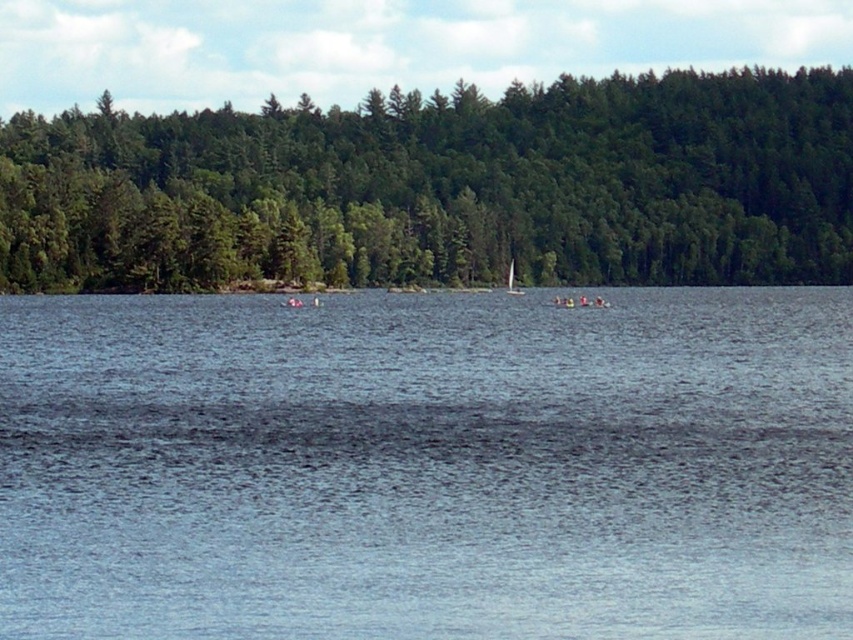
You are standing on the lakeside and want to compare the height of the green matte forest at center and the white glossy sailboat at center. Which one is taller?

The green matte forest at center has a greater height compared to the white glossy sailboat at center, so the green matte forest at center is taller.

Looking at this image, you are standing on the lakeside and want to determine which object is closer to the water surface between the blue water at center and the white glossy sailboat at center. Based on their heights, which one is closer?

The blue water at center has a lesser height compared to the white glossy sailboat at center, so the blue water at center is closer to the water surface.

You are a photographer planning to take a photo of the white glossy sailboat at center. Since the blue water at center is underneath it, will the sailboat appear to be floating on the water in the photo?

Yes, the white glossy sailboat at center will appear to be floating on the blue water at center because the blue water at center is positioned under it, creating a natural reflection and positioning for the sailboat.